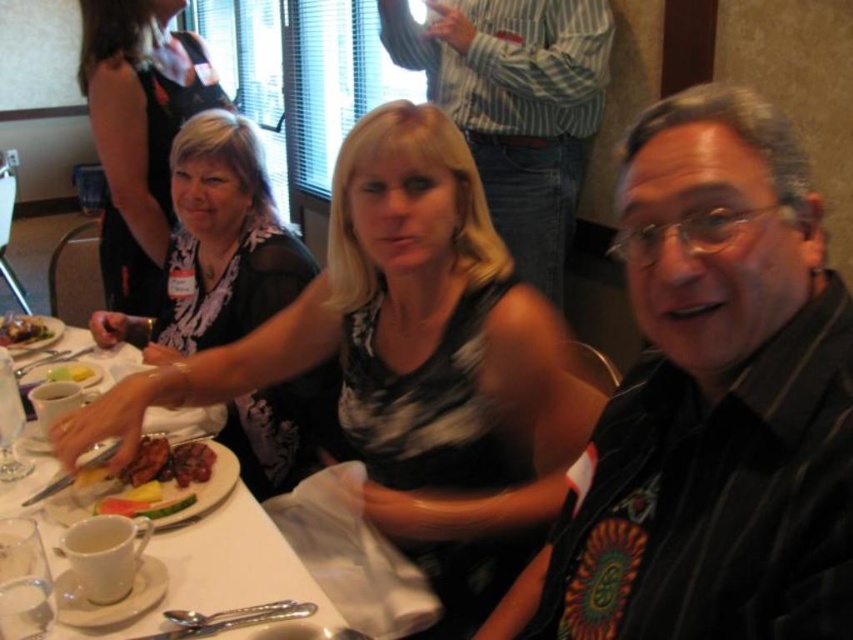
Question: Can you confirm if black textured dress at center is smaller than yellow matte lemon at upper left?

Choices:
 (A) yes
 (B) no

Answer: (B)

Question: Does white ceramic plate at lower left appear under brown glossy steak at center?

Choices:
 (A) no
 (B) yes

Answer: (B)

Question: Which is farther from the brown glossy steak at center?

Choices:
 (A) white glossy plate at center
 (B) black mesh dress at upper left
 (C) white ceramic plate at lower left
 (D) striped shirt at upper right

Answer: (D)

Question: Estimate the real-world distances between objects in this image. Which object is farther from the yellow matte lemon at upper left?

Choices:
 (A) white glossy plate at center
 (B) black textured dress at center

Answer: (B)

Question: Does black striped shirt at right lie behind brown glossy steak at center?

Choices:
 (A) no
 (B) yes

Answer: (A)

Question: Among these points, which one is nearest to the camera?

Choices:
 (A) (280, 317)
 (B) (165, 150)

Answer: (A)